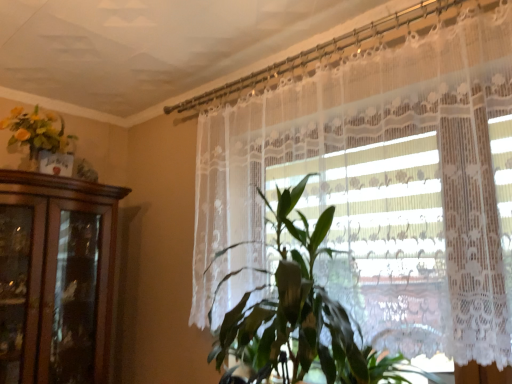
Identify the location of white lace curtain at center. Image resolution: width=512 pixels, height=384 pixels. (381, 186).

This screenshot has width=512, height=384. Find the location of `white lace curtain at center`. white lace curtain at center is located at coordinates (381, 186).

Could you tell me if matte yellow flowers at upper left is turned towards green leafy plant at center?

Yes.

Measure the distance between matte yellow flowers at upper left and green leafy plant at center.

matte yellow flowers at upper left is 1.42 meters away from green leafy plant at center.

Is matte yellow flowers at upper left inside the boundaries of green leafy plant at center, or outside?

matte yellow flowers at upper left is not enclosed by green leafy plant at center.

Which of these two, matte yellow flowers at upper left or green leafy plant at center, is thinner?

Thinner between the two is matte yellow flowers at upper left.

Considering the relative positions of green leafy plant at center and matte yellow flowers at upper left in the image provided, is green leafy plant at center in front of matte yellow flowers at upper left?

Yes, green leafy plant at center is closer to the viewer.

Considering the relative sizes of green leafy plant at center and matte yellow flowers at upper left in the image provided, is green leafy plant at center taller than matte yellow flowers at upper left?

Yes.

Is point (226, 332) positioned before point (66, 139)?

Yes, it is in front of point (66, 139).

From a real-world perspective, does matte yellow flowers at upper left sit lower than white lace curtain at center?

No.

From the image's perspective, is matte yellow flowers at upper left below white lace curtain at center?

Actually, matte yellow flowers at upper left appears above white lace curtain at center in the image.

Does point (59, 117) come behind point (402, 166)?

Yes, it is behind point (402, 166).

Looking at this image, can we say green leafy plant at center lies outside white lace curtain at center?

Yes, green leafy plant at center is outside of white lace curtain at center.

Considering the sizes of objects green leafy plant at center and white lace curtain at center in the image provided, who is wider, green leafy plant at center or white lace curtain at center?

With larger width is green leafy plant at center.

Is the position of green leafy plant at center more distant than that of white lace curtain at center?

That is False.

In the scene shown: From the image's perspective, is white lace curtain at center located beneath matte yellow flowers at upper left?

Correct, white lace curtain at center appears lower than matte yellow flowers at upper left in the image.

In the image, is white lace curtain at center on the left side or the right side of matte yellow flowers at upper left?

white lace curtain at center is to the right of matte yellow flowers at upper left.

Is white lace curtain at center aimed at matte yellow flowers at upper left?

No, white lace curtain at center is not facing towards matte yellow flowers at upper left.

Is white lace curtain at center in contact with matte yellow flowers at upper left?

No, white lace curtain at center is not next to matte yellow flowers at upper left.

Based on their sizes in the image, would you say white lace curtain at center is bigger or smaller than green leafy plant at center?

In the image, white lace curtain at center appears to be larger than green leafy plant at center.

Would you say white lace curtain at center is inside or outside green leafy plant at center?

white lace curtain at center exists outside the volume of green leafy plant at center.

Considering the relative positions of white lace curtain at center and green leafy plant at center in the image provided, is white lace curtain at center behind green leafy plant at center?

Yes, white lace curtain at center is further from the viewer.

How different are the orientations of white lace curtain at center and green leafy plant at center in degrees?

The angular difference between white lace curtain at center and green leafy plant at center is 3.69 degrees.

In the image, there is a matte yellow flowers at upper left. What are the coordinates of `houseplant below it (from the image's perspective)` in the screenshot? It's located at (298, 314).

Where is `houseplant on the right of the matte yellow flowers at upper left`? houseplant on the right of the matte yellow flowers at upper left is located at coordinates (298, 314).

Based on the photo, based on their spatial positions, is matte yellow flowers at upper left or green leafy plant at center further from white lace curtain at center?

matte yellow flowers at upper left.

When comparing their distances from white lace curtain at center, does green leafy plant at center or matte yellow flowers at upper left seem closer?

The object closer to white lace curtain at center is green leafy plant at center.

When comparing their distances from matte yellow flowers at upper left, does white lace curtain at center or green leafy plant at center seem further?

Among the two, green leafy plant at center is located further to matte yellow flowers at upper left.

Considering their positions, is green leafy plant at center positioned closer to matte yellow flowers at upper left than white lace curtain at center?

white lace curtain at center is closer to matte yellow flowers at upper left.

Based on their spatial positions, is white lace curtain at center or matte yellow flowers at upper left closer to green leafy plant at center?

white lace curtain at center.

Which object lies further to the anchor point green leafy plant at center, matte yellow flowers at upper left or white lace curtain at center?

matte yellow flowers at upper left.

At what (x,y) coordinates should I click in order to perform the action: click on houseplant between matte yellow flowers at upper left and white lace curtain at center in the horizontal direction. Please return your answer as a coordinate pair (x, y). Looking at the image, I should click on (298, 314).